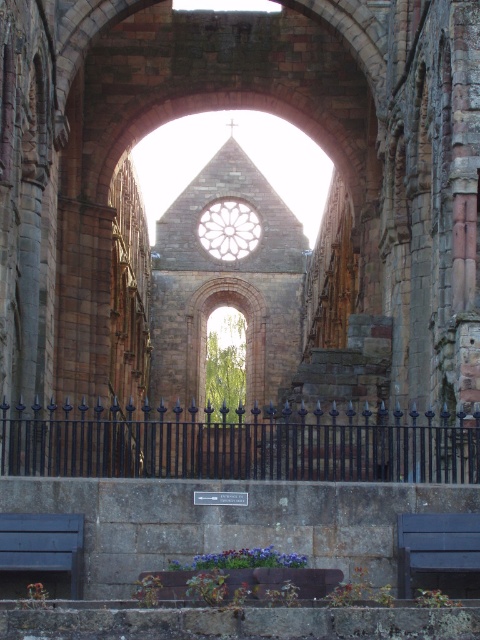
Is blue painted wood bench at lower left to the left of dark blue wood bench at lower right from the viewer's perspective?

Yes, blue painted wood bench at lower left is to the left of dark blue wood bench at lower right.

Is blue painted wood bench at lower left taller than dark blue wood bench at lower right?

No, blue painted wood bench at lower left is not taller than dark blue wood bench at lower right.

Is point (60, 548) farther from camera compared to point (427, 570)?

That is True.

The image size is (480, 640). Identify the location of blue painted wood bench at lower left. (44, 545).